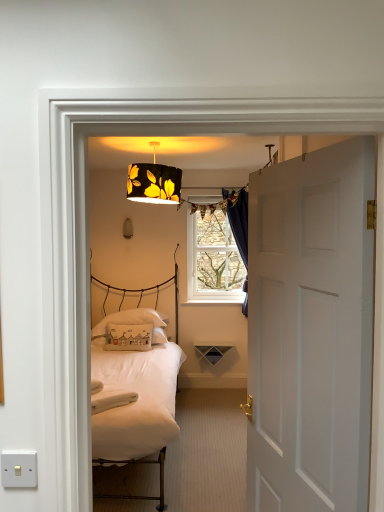
Question: Do you think dark blue velvet curtain at upper center is within white matte door at right, or outside of it?

Choices:
 (A) outside
 (B) inside

Answer: (A)

Question: From the image's perspective, is dark blue velvet curtain at upper center located above or below white matte door at right?

Choices:
 (A) above
 (B) below

Answer: (A)

Question: Estimate the real-world distances between objects in this image. Which object is closer to the white plastic switch at lower left?

Choices:
 (A) black fabric lampshade at upper center, which is counted as the first lamp, starting from the front
 (B) clear glass window at center
 (C) black fabric lampshade at upper center, positioned as the first lamp in back-to-front order
 (D) white matte door at right
 (E) white cotton pillow at center, which ranks as the 1th pillow in front-to-back order

Answer: (D)

Question: Which object is the closest to the dark blue velvet curtain at upper center?

Choices:
 (A) white cotton pillow at center, which ranks as the 1th pillow in front-to-back order
 (B) clear glass window at center
 (C) black fabric lampshade at upper center, the 2th lamp positioned from the right
 (D) black fabric lampshade at upper center, marked as the 2th lamp in a left-to-right arrangement
 (E) white plastic switch at lower left

Answer: (B)